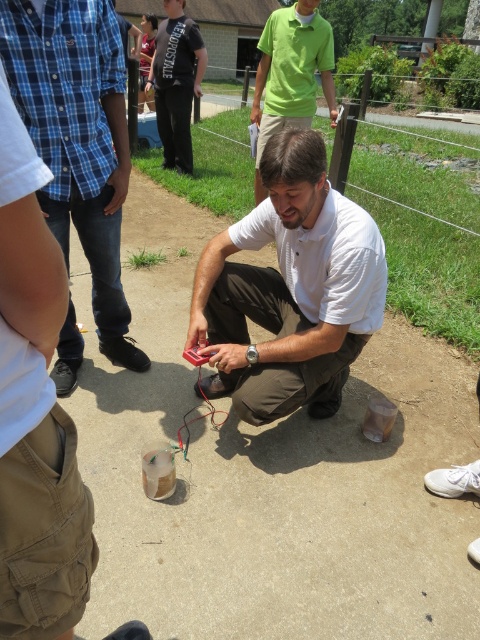
Question: Is blue plaid shirt at left smaller than green cotton shirt at center?

Choices:
 (A) yes
 (B) no

Answer: (B)

Question: Which of these objects is positioned farthest from the white matte shirt at center?

Choices:
 (A) green cotton shirt at center
 (B) blue plaid shirt at left

Answer: (A)

Question: Is white matte shirt at center thinner than blue plaid shirt at left?

Choices:
 (A) no
 (B) yes

Answer: (A)

Question: Based on their relative distances, which object is farther from the black cotton t-shirt at upper center?

Choices:
 (A) white matte shirt at center
 (B) green cotton shirt at center
 (C) blue plaid shirt at left

Answer: (A)

Question: Does blue plaid shirt at left lie behind black cotton t-shirt at upper center?

Choices:
 (A) yes
 (B) no

Answer: (B)

Question: Which point is farther to the camera?

Choices:
 (A) green cotton shirt at center
 (B) black cotton t-shirt at upper center
 (C) white matte shirt at center
 (D) blue plaid shirt at left

Answer: (B)